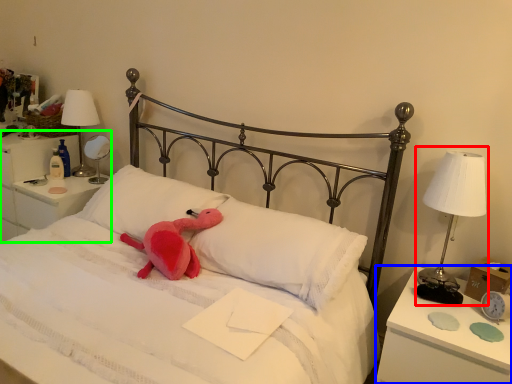
Question: Based on their relative distances, which object is nearer to bedside lamp (highlighted by a red box)? Choose from nightstand (highlighted by a blue box) and nightstand (highlighted by a green box).

Choices:
 (A) nightstand
 (B) nightstand

Answer: (A)